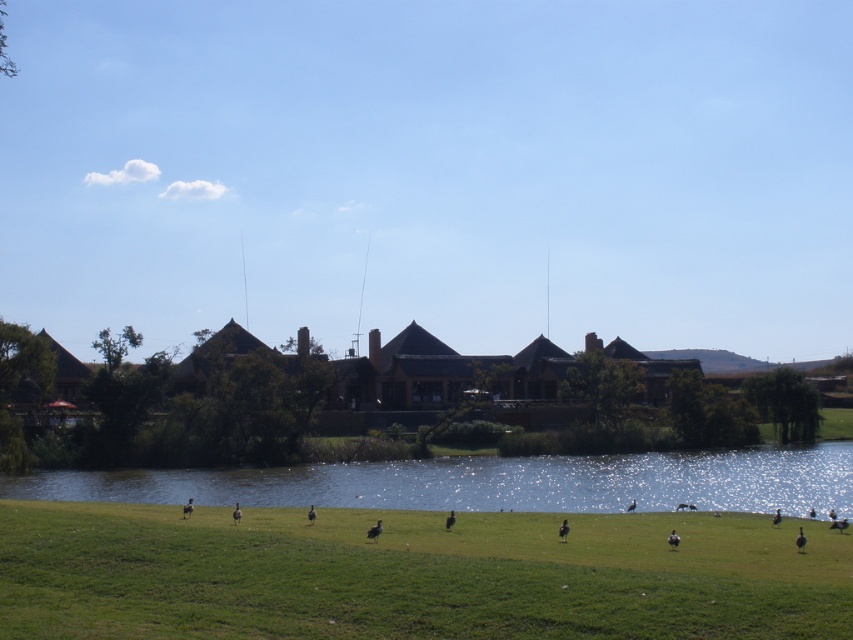
Is green grassy field at lower center below blue reflective water at center?

Incorrect, green grassy field at lower center is not positioned below blue reflective water at center.

Can you confirm if green grassy field at lower center is positioned to the left of blue reflective water at center?

Correct, you'll find green grassy field at lower center to the left of blue reflective water at center.

Locate an element on the screen. The width and height of the screenshot is (853, 640). green grassy field at lower center is located at coordinates (412, 573).

Locate an element on the screen. This screenshot has height=640, width=853. green grassy field at lower center is located at coordinates (412, 573).